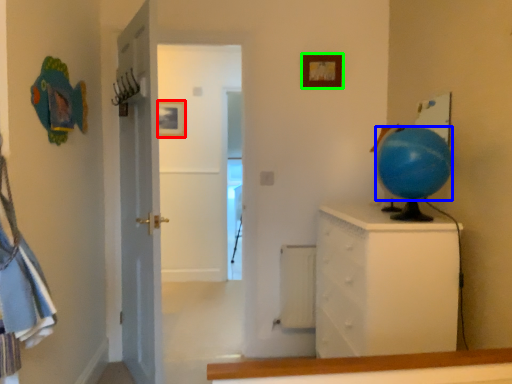
Question: Which is nearer to the picture frame (highlighted by a red box)? balloon (highlighted by a blue box) or picture frame (highlighted by a green box).

Choices:
 (A) balloon
 (B) picture frame

Answer: (B)